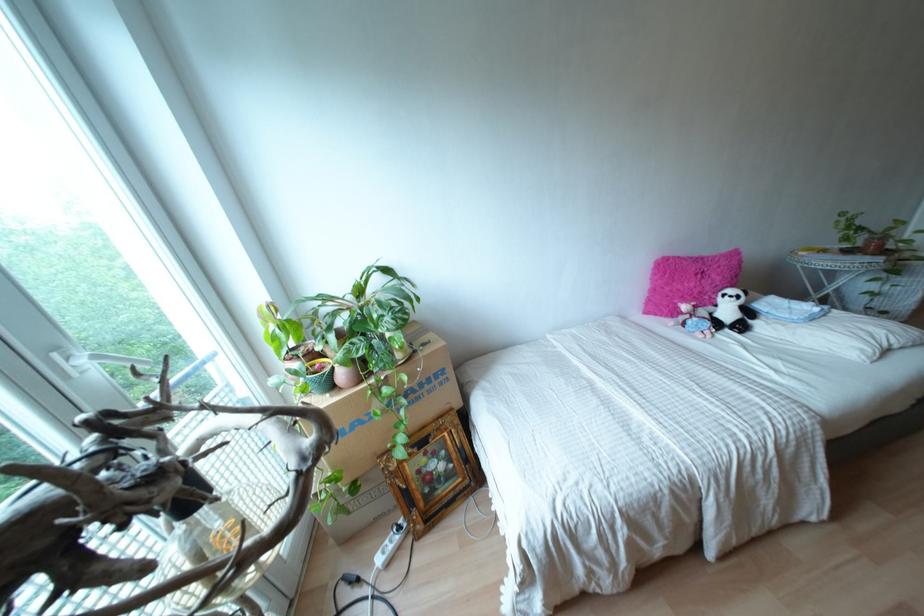
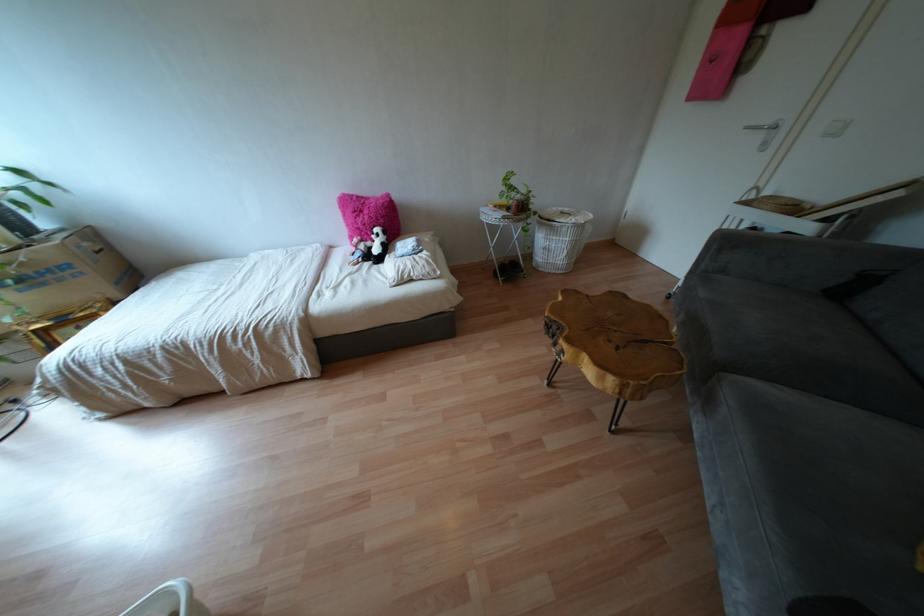
Where in the second image is the point corresponding to (847,251) from the first image?

(506, 208)